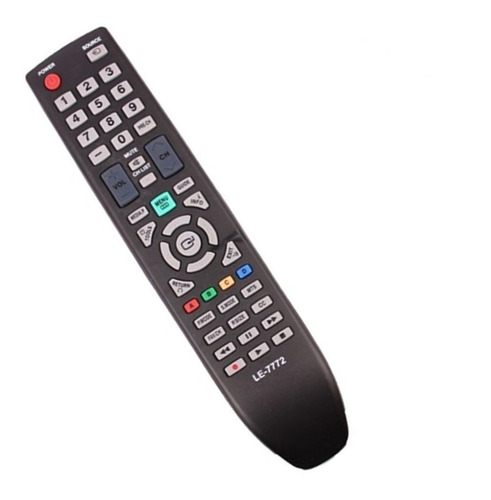
At what (x,y) coordinates should I click in order to perform the action: click on number buttons on remote control. Please return your answer as a coordinate pair (x, y). The image size is (491, 500). Looking at the image, I should click on (64, 102), (76, 118), (88, 135), (89, 85), (99, 102), (111, 120), (123, 139), (110, 71), (122, 91), (133, 106).